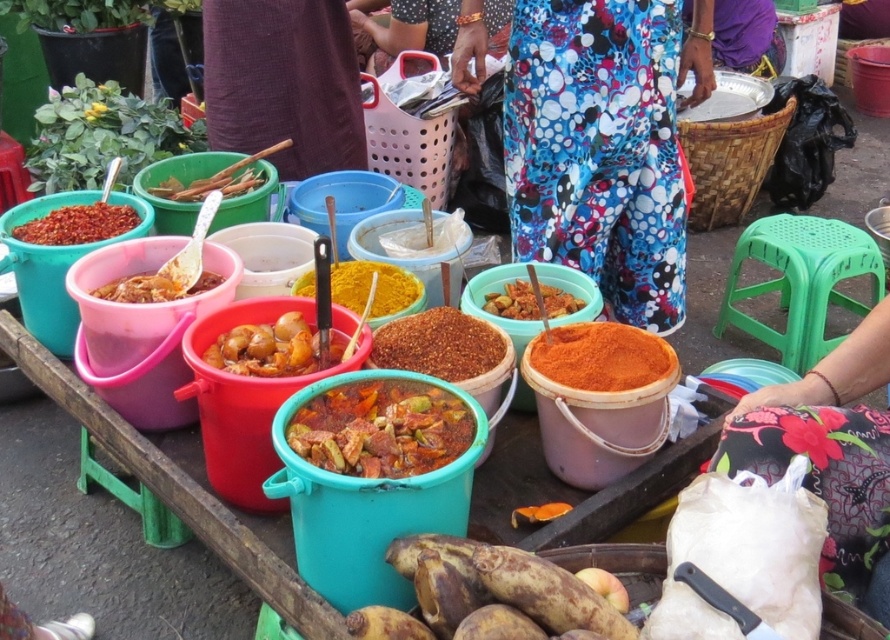
Between shiny red sauce at center and bright red powder at center, which one is positioned higher?

Positioned higher is bright red powder at center.

Between point (429, 435) and point (104, 208), which one is positioned in front?

Point (429, 435) is in front.

Who is more distant from viewer, (356, 461) or (86, 237)?

The point (86, 237) is more distant.

The width and height of the screenshot is (890, 640). Identify the location of shiny red sauce at center. (381, 428).

What do you see at coordinates (282, 83) in the screenshot? This screenshot has width=890, height=640. I see `brown fabric at upper center` at bounding box center [282, 83].

Who is taller, brown fabric at upper center or slightly translucent plastic bowl at left?

brown fabric at upper center is taller.

Who is more distant from viewer, (x=340, y=44) or (x=174, y=285)?

The point (x=340, y=44) is more distant.

The width and height of the screenshot is (890, 640). Identify the location of brown fabric at upper center. (282, 83).

Is brown fabric at upper center shorter than shiny red sauce at center?

Incorrect, brown fabric at upper center's height does not fall short of shiny red sauce at center's.

Consider the image. Can you confirm if brown fabric at upper center is positioned to the left of shiny red sauce at center?

Yes, brown fabric at upper center is to the left of shiny red sauce at center.

Is point (360, 115) behind point (383, 465)?

Yes, point (360, 115) is behind point (383, 465).

In order to click on brown fabric at upper center in this screenshot , I will do `click(282, 83)`.